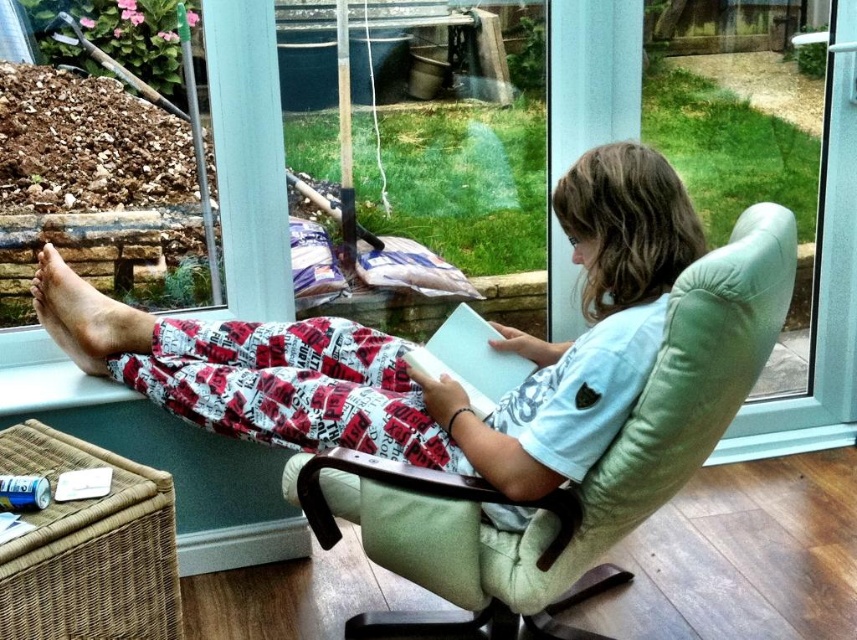
Question: Does light blue cotton shirt at center have a larger size compared to skinny barefoot at lower left?

Choices:
 (A) no
 (B) yes

Answer: (B)

Question: Which point is farther to the camera?

Choices:
 (A) (105, 340)
 (B) (298, 448)

Answer: (A)

Question: From the image, what is the correct spatial relationship of light blue cotton shirt at center in relation to skinny barefoot at lower left?

Choices:
 (A) left
 (B) right

Answer: (B)

Question: Is light blue cotton shirt at center to the left of skinny barefoot at lower left from the viewer's perspective?

Choices:
 (A) yes
 (B) no

Answer: (B)